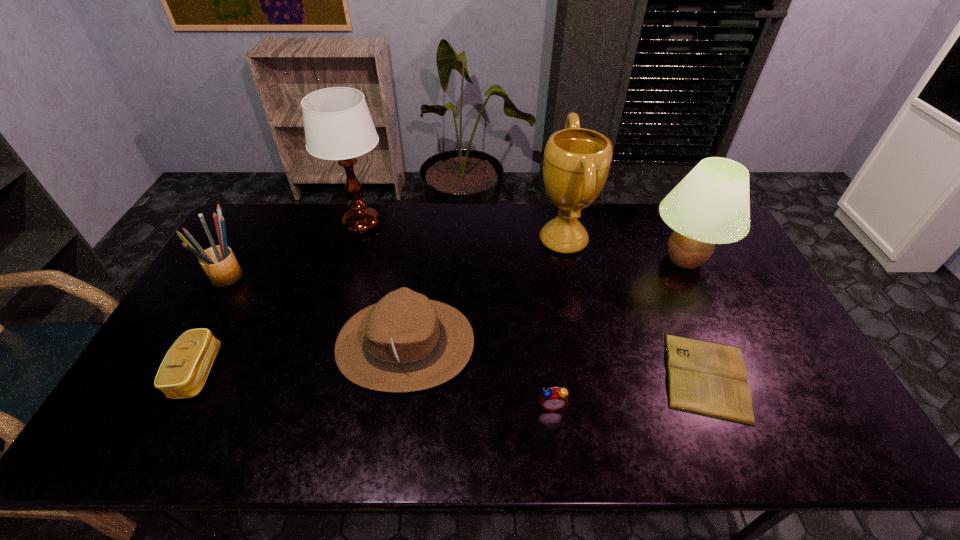
The height and width of the screenshot is (540, 960). I want to click on free spot at the right edge of the desktop, so click(x=733, y=259).

This screenshot has height=540, width=960. Find the location of `free spot at the far left corner of the desktop`. free spot at the far left corner of the desktop is located at coordinates (264, 242).

I want to click on free spot at the near left corner of the desktop, so click(182, 420).

You are a GUI agent. You are given a task and a screenshot of the screen. Output one action in this format:
    pyautogui.click(x=<x>, y=<y>)
    Task: Click on the vacant space in between the clutch bag and the table lamp
    Image resolution: width=960 pixels, height=540 pixels.
    Given the screenshot: What is the action you would take?
    pyautogui.click(x=280, y=298)

Locate an element on the screen. vacant region between the fourth shortest object and the alarm clock is located at coordinates (479, 375).

Locate an element on the screen. unoccupied position between the lampshade and the fedora is located at coordinates (545, 301).

Identify the location of free space between the lampshade and the shortest object. (695, 318).

Identify the location of free space between the alarm clock and the award. Image resolution: width=960 pixels, height=540 pixels. (558, 322).

Identify the location of empty space that is in between the alarm clock and the award. The image size is (960, 540). (558, 322).

This screenshot has height=540, width=960. What are the coordinates of `object that can be found as the third closest to the award` in the screenshot? It's located at 705,378.